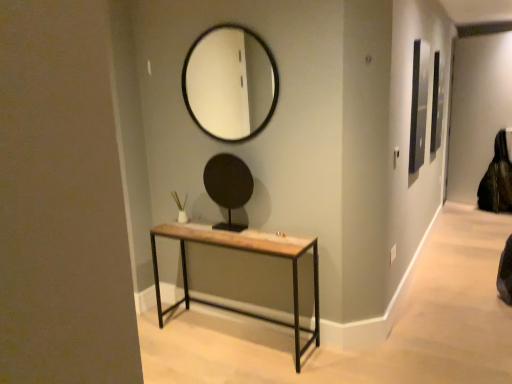
Where is `black glass mirror at upper center, which appears as the 2th mirror when ordered from the bottom`? The image size is (512, 384). black glass mirror at upper center, which appears as the 2th mirror when ordered from the bottom is located at coordinates (224, 83).

At what (x,y) coordinates should I click in order to perform the action: click on black leather swivel chair at right. Please return your answer as a coordinate pair (x, y). Looking at the image, I should click on (497, 179).

Identify the location of table below the black leather swivel chair at right (from the image's perspective). This screenshot has width=512, height=384. [243, 251].

From the image's perspective, which one is positioned higher, black leather swivel chair at right or rustic wood table at center?

black leather swivel chair at right.

Based on the photo, is rustic wood table at center a part of black leather swivel chair at right?

No.

This screenshot has height=384, width=512. I want to click on mirror that is the 1st object to the left of the black leather swivel chair at right, starting at the anchor, so click(228, 181).

Between point (505, 192) and point (241, 171), which one is positioned behind?

The point (505, 192) is farther.

Considering their positions, is black leather swivel chair at right located in front of or behind black matte mirror at center, which appears as the 2th mirror when viewed from the top?

black leather swivel chair at right is positioned farther from the viewer than black matte mirror at center, which appears as the 2th mirror when viewed from the top.

From the image's perspective, between black leather swivel chair at right and black matte mirror at center, which appears as the 2th mirror when viewed from the top, which one is located above?

From the image's view, black leather swivel chair at right is above.

From a real-world perspective, between rustic wood table at center and black leather swivel chair at right, who is vertically lower?

In real-world perspective, rustic wood table at center is lower.

Considering the sizes of objects rustic wood table at center and black leather swivel chair at right in the image provided, who is thinner, rustic wood table at center or black leather swivel chair at right?

rustic wood table at center.

Is rustic wood table at center not close to black leather swivel chair at right?

That's right, there is a large distance between rustic wood table at center and black leather swivel chair at right.

Can you tell me how much rustic wood table at center and black leather swivel chair at right differ in facing direction?

The angle between the facing direction of rustic wood table at center and the facing direction of black leather swivel chair at right is 2.47 degrees.

Is rustic wood table at center aimed at black matte mirror at center, which appears as the 2th mirror when viewed from the top?

No, rustic wood table at center is not facing towards black matte mirror at center, which appears as the 2th mirror when viewed from the top.

Which of these two, rustic wood table at center or black matte mirror at center, marked as the first mirror in a bottom-to-top arrangement, is bigger?

rustic wood table at center.

Is black matte mirror at center, marked as the first mirror in a bottom-to-top arrangement, inside rustic wood table at center?

No, black matte mirror at center, marked as the first mirror in a bottom-to-top arrangement, is not a part of rustic wood table at center.

Looking at this image, is rustic wood table at center beside black matte mirror at center, which appears as the 2th mirror when viewed from the top?

No, rustic wood table at center is not making contact with black matte mirror at center, which appears as the 2th mirror when viewed from the top.

Is black matte mirror at center, marked as the first mirror in a bottom-to-top arrangement, oriented towards black leather swivel chair at right?

No, black matte mirror at center, marked as the first mirror in a bottom-to-top arrangement, is not turned towards black leather swivel chair at right.

From a real-world perspective, which mirror is the 1st one above the black leather swivel chair at right? Please provide its 2D coordinates.

[(228, 181)]

How many degrees apart are the facing directions of black matte mirror at center, which appears as the 2th mirror when viewed from the top, and black leather swivel chair at right?

The facing directions of black matte mirror at center, which appears as the 2th mirror when viewed from the top, and black leather swivel chair at right are 2.47 degrees apart.

Can you confirm if black matte mirror at center, marked as the first mirror in a bottom-to-top arrangement, is thinner than black leather swivel chair at right?

Yes.

Considering the relative sizes of black leather swivel chair at right and black glass mirror at upper center, which appears as the 2th mirror when ordered from the bottom, in the image provided, is black leather swivel chair at right wider than black glass mirror at upper center, which appears as the 2th mirror when ordered from the bottom,?

Yes.

Looking at this image, is black leather swivel chair at right situated inside black glass mirror at upper center, the first mirror from the top, or outside?

black leather swivel chair at right lies outside black glass mirror at upper center, the first mirror from the top.

Considering the positions of objects black leather swivel chair at right and black glass mirror at upper center, which appears as the 2th mirror when ordered from the bottom, in the image provided, who is in front, black leather swivel chair at right or black glass mirror at upper center, which appears as the 2th mirror when ordered from the bottom,?

black glass mirror at upper center, which appears as the 2th mirror when ordered from the bottom.

Does black leather swivel chair at right appear on the left side of black glass mirror at upper center, the first mirror from the top?

Incorrect, black leather swivel chair at right is not on the left side of black glass mirror at upper center, the first mirror from the top.

You are a GUI agent. You are given a task and a screenshot of the screen. Output one action in this format:
    pyautogui.click(x=<x>, y=<y>)
    Task: Click on the table that appears in front of the black matte mirror at center, which appears as the 2th mirror when viewed from the top
    The width and height of the screenshot is (512, 384).
    Given the screenshot: What is the action you would take?
    pyautogui.click(x=243, y=251)

Is black matte mirror at center, which appears as the 2th mirror when viewed from the top, at the left side of rustic wood table at center?

Correct, you'll find black matte mirror at center, which appears as the 2th mirror when viewed from the top, to the left of rustic wood table at center.

Could you tell me if black matte mirror at center, which appears as the 2th mirror when viewed from the top, is turned towards rustic wood table at center?

No, black matte mirror at center, which appears as the 2th mirror when viewed from the top, does not turn towards rustic wood table at center.

Are black matte mirror at center, which appears as the 2th mirror when viewed from the top, and rustic wood table at center far apart?

That's not correct — black matte mirror at center, which appears as the 2th mirror when viewed from the top, is a little close to rustic wood table at center.

Where is `swivel chair that is on the right side of rustic wood table at center`? swivel chair that is on the right side of rustic wood table at center is located at coordinates (497, 179).

Which mirror is the 1st one when counting from the left side of the black leather swivel chair at right? Please provide its 2D coordinates.

[(228, 181)]

Which object lies nearer to the anchor point rustic wood table at center, black leather swivel chair at right or black matte mirror at center, marked as the first mirror in a bottom-to-top arrangement?

Based on the image, black matte mirror at center, marked as the first mirror in a bottom-to-top arrangement, appears to be nearer to rustic wood table at center.

Estimate the real-world distances between objects in this image. Which object is closer to black matte mirror at center, which appears as the 2th mirror when viewed from the top, rustic wood table at center or black leather swivel chair at right?

rustic wood table at center is closer to black matte mirror at center, which appears as the 2th mirror when viewed from the top.

From the image, which object appears to be farther from black leather swivel chair at right, black glass mirror at upper center, the first mirror from the top, or black matte mirror at center, marked as the first mirror in a bottom-to-top arrangement?

black matte mirror at center, marked as the first mirror in a bottom-to-top arrangement.

Estimate the real-world distances between objects in this image. Which object is further from black leather swivel chair at right, rustic wood table at center or black matte mirror at center, which appears as the 2th mirror when viewed from the top?

Based on the image, black matte mirror at center, which appears as the 2th mirror when viewed from the top, appears to be further to black leather swivel chair at right.

From the image, which object appears to be farther from rustic wood table at center, black matte mirror at center, which appears as the 2th mirror when viewed from the top, or black leather swivel chair at right?

Based on the image, black leather swivel chair at right appears to be further to rustic wood table at center.

Looking at the image, which one is located further to black glass mirror at upper center, which appears as the 2th mirror when ordered from the bottom, black matte mirror at center, marked as the first mirror in a bottom-to-top arrangement, or black leather swivel chair at right?

Based on the image, black leather swivel chair at right appears to be further to black glass mirror at upper center, which appears as the 2th mirror when ordered from the bottom.

Looking at the image, which one is located further to black glass mirror at upper center, the first mirror from the top, black leather swivel chair at right or rustic wood table at center?

The object further to black glass mirror at upper center, the first mirror from the top, is black leather swivel chair at right.

Based on their spatial positions, is black matte mirror at center, which appears as the 2th mirror when viewed from the top, or black glass mirror at upper center, the first mirror from the top, further from rustic wood table at center?

black glass mirror at upper center, the first mirror from the top, is positioned further to the anchor rustic wood table at center.

Identify the location of mirror between black glass mirror at upper center, the first mirror from the top, and black leather swivel chair at right from left to right. point(228,181).

Where is `table located between black matte mirror at center, marked as the first mirror in a bottom-to-top arrangement, and black leather swivel chair at right in the left-right direction`? This screenshot has height=384, width=512. table located between black matte mirror at center, marked as the first mirror in a bottom-to-top arrangement, and black leather swivel chair at right in the left-right direction is located at coordinates (243, 251).

The width and height of the screenshot is (512, 384). Find the location of `table located between black glass mirror at upper center, the first mirror from the top, and black leather swivel chair at right in the left-right direction`. table located between black glass mirror at upper center, the first mirror from the top, and black leather swivel chair at right in the left-right direction is located at coordinates (243, 251).

Image resolution: width=512 pixels, height=384 pixels. Find the location of `mirror between black glass mirror at upper center, which appears as the 2th mirror when ordered from the bottom, and rustic wood table at center in the up-down direction`. mirror between black glass mirror at upper center, which appears as the 2th mirror when ordered from the bottom, and rustic wood table at center in the up-down direction is located at coordinates (228, 181).